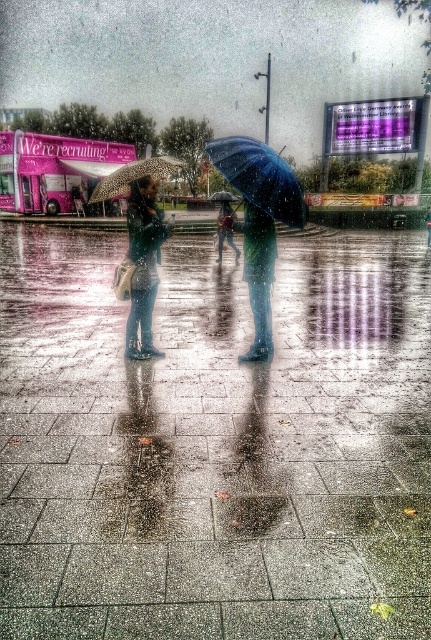
Question: Which is nearer to the blue matte umbrella at center?

Choices:
 (A) blue rubber boots at center
 (B) leopard print fabric umbrella at center
 (C) shiny concrete pavement at center
 (D) matte pink bus at left

Answer: (D)

Question: Which of the following is the closest to the observer?

Choices:
 (A) blue rubber boots at center
 (B) blue matte umbrella at center
 (C) shiny concrete pavement at center

Answer: (C)

Question: Is matte blue jacket at center bigger than leopard print fabric umbrella at center?

Choices:
 (A) yes
 (B) no

Answer: (B)

Question: Can you confirm if rubber boots at center is positioned below blue matte umbrella at center?

Choices:
 (A) no
 (B) yes

Answer: (B)

Question: Which of the following is the farthest from the observer?

Choices:
 (A) shiny blue umbrella at center
 (B) shiny concrete pavement at center
 (C) blue matte umbrella at center
 (D) blue rubber boots at center

Answer: (C)

Question: Can you confirm if leopard print fabric umbrella at center is positioned above rubber boots at center?

Choices:
 (A) no
 (B) yes

Answer: (B)